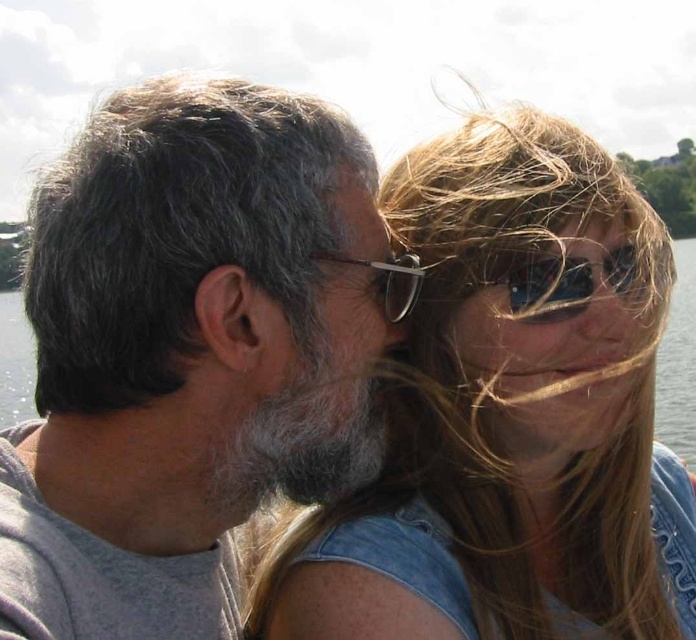
Does gray matte hair at left have a lesser width compared to denim jacket at upper right?

Yes, gray matte hair at left is thinner than denim jacket at upper right.

Does gray matte hair at left have a lesser height compared to denim jacket at upper right?

Yes, gray matte hair at left is shorter than denim jacket at upper right.

Does point (171, 435) lie behind point (519, 189)?

No, it is in front of (519, 189).

What are the coordinates of `gray matte hair at left` in the screenshot? It's located at (181, 353).

Is denim jacket at upper right bigger than transparent water at center?

Incorrect, denim jacket at upper right is not larger than transparent water at center.

Which is more to the right, denim jacket at upper right or transparent water at center?

From the viewer's perspective, transparent water at center appears more on the right side.

Who is more distant from viewer, (x=530, y=419) or (x=693, y=244)?

Point (x=693, y=244)

In order to click on denim jacket at upper right in this screenshot , I will do `click(507, 416)`.

Is denim jacket at upper right smaller than metallic reflective glasses at center?

No, denim jacket at upper right is not smaller than metallic reflective glasses at center.

Who is higher up, denim jacket at upper right or metallic reflective glasses at center?

metallic reflective glasses at center is higher up.

This screenshot has width=696, height=640. Identify the location of denim jacket at upper right. (507, 416).